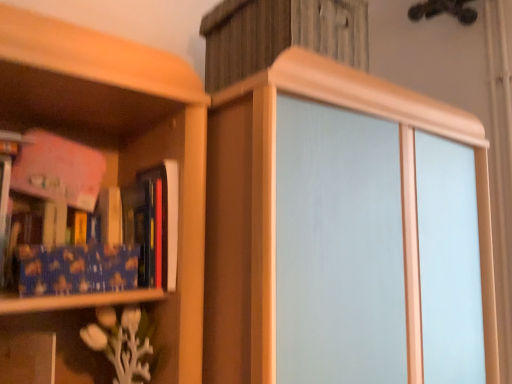
What do you see at coordinates (76, 269) in the screenshot? I see `blue textured paper at left` at bounding box center [76, 269].

Image resolution: width=512 pixels, height=384 pixels. What do you see at coordinates (76, 347) in the screenshot?
I see `white matte vase at lower left` at bounding box center [76, 347].

At what (x,y) coordinates should I click in order to perform the action: click on hardcover book at left, positioned as the second book in left-to-right order. Please return your answer as a coordinate pair (x, y). Looking at the image, I should click on (165, 217).

This screenshot has height=384, width=512. Identify the location of blue textured paper at left. (76, 269).

How much distance is there between blue textured paper at left and hardcover book at left, positioned as the second book in left-to-right order?

blue textured paper at left and hardcover book at left, positioned as the second book in left-to-right order, are 4.78 inches apart.

Is blue textured paper at left aimed at hardcover book at left, positioned as the second book in left-to-right order?

No, blue textured paper at left is not facing towards hardcover book at left, positioned as the second book in left-to-right order.

Looking at this image, which is behind, blue textured paper at left or hardcover book at left, arranged as the first book when viewed from the right?

hardcover book at left, arranged as the first book when viewed from the right.

Considering the sizes of objects blue textured paper at left and hardcover book at left, arranged as the first book when viewed from the right, in the image provided, who is thinner, blue textured paper at left or hardcover book at left, arranged as the first book when viewed from the right,?

blue textured paper at left is thinner.

Does hardcover book at left, positioned as the second book in left-to-right order, turn towards white matte vase at lower left?

No.

Between point (164, 241) and point (90, 342), which one is positioned in front?

The point (164, 241) is in front.

Considering the relative sizes of hardcover book at left, positioned as the second book in left-to-right order, and white matte vase at lower left in the image provided, is hardcover book at left, positioned as the second book in left-to-right order, thinner than white matte vase at lower left?

Yes, hardcover book at left, positioned as the second book in left-to-right order, is thinner than white matte vase at lower left.

Does hardcover book at left, arranged as the first book when viewed from the right, touch white matte vase at lower left?

hardcover book at left, arranged as the first book when viewed from the right, is not next to white matte vase at lower left, and they're not touching.

Is hardcover book at left, arranged as the first book when viewed from the right, placed right next to blue textured fabric book at left, the 2th book viewed from the right?

No.

Can you tell me how much hardcover book at left, arranged as the first book when viewed from the right, and blue textured fabric book at left, the 2th book viewed from the right, differ in facing direction?

7.52 degrees separate the facing orientations of hardcover book at left, arranged as the first book when viewed from the right, and blue textured fabric book at left, the 2th book viewed from the right.

Can you confirm if hardcover book at left, positioned as the second book in left-to-right order, is smaller than blue textured fabric book at left, arranged as the 1th book when viewed from the left?

Yes.

Is the depth of hardcover book at left, arranged as the first book when viewed from the right, greater than that of blue textured fabric book at left, the 2th book viewed from the right?

Yes.

Which is more to the left, white matte vase at lower left or blue textured fabric book at left, the 2th book viewed from the right?

blue textured fabric book at left, the 2th book viewed from the right, is more to the left.

There is a white matte vase at lower left. Identify the location of the 2nd book above it (from the image's perspective). (95, 225).

Consider the image. From a real-world perspective, which is physically above, white matte vase at lower left or blue textured fabric book at left, arranged as the 1th book when viewed from the left?

blue textured fabric book at left, arranged as the 1th book when viewed from the left, is physically above.

Considering the points (99, 375) and (55, 184), which point is behind, point (99, 375) or point (55, 184)?

The point (99, 375) is farther.

Is point (176, 165) closer to viewer compared to point (109, 251)?

Yes, it is in front of point (109, 251).

Between hardcover book at left, arranged as the first book when viewed from the right, and blue textured paper at left, which one has smaller width?

blue textured paper at left is thinner.

Which is more to the left, hardcover book at left, positioned as the second book in left-to-right order, or blue textured paper at left?

From the viewer's perspective, blue textured paper at left appears more on the left side.

Is hardcover book at left, arranged as the first book when viewed from the right, behind blue textured paper at left?

Yes, hardcover book at left, arranged as the first book when viewed from the right, is further from the viewer.

I want to click on shelf below the blue textured fabric book at left, arranged as the 1th book when viewed from the left (from the image's perspective), so click(x=76, y=347).

Which object is further away from the camera taking this photo, blue textured fabric book at left, arranged as the 1th book when viewed from the left, or white matte vase at lower left?

blue textured fabric book at left, arranged as the 1th book when viewed from the left, is behind.

Is blue textured fabric book at left, the 2th book viewed from the right, facing away from white matte vase at lower left?

No, blue textured fabric book at left, the 2th book viewed from the right, is not facing away from white matte vase at lower left.

Considering the relative sizes of blue textured fabric book at left, arranged as the 1th book when viewed from the left, and white matte vase at lower left in the image provided, is blue textured fabric book at left, arranged as the 1th book when viewed from the left, shorter than white matte vase at lower left?

No.

Considering the positions of objects blue textured paper at left and white matte vase at lower left in the image provided, who is more to the right, blue textured paper at left or white matte vase at lower left?

blue textured paper at left is more to the right.

Is point (81, 245) less distant than point (42, 368)?

That is False.

Are blue textured paper at left and white matte vase at lower left making contact?

No, blue textured paper at left is not in contact with white matte vase at lower left.

From a real-world perspective, count 1st books upward from the blue textured paper at left and point to it. Please provide its 2D coordinates.

[(165, 217)]

This screenshot has width=512, height=384. In order to click on shelf in front of the hardcover book at left, positioned as the second book in left-to-right order in this screenshot , I will do `click(76, 347)`.

In the scene shown: When comparing their distances from blue textured paper at left, does white matte vase at lower left or hardcover book at left, positioned as the second book in left-to-right order, seem further?

white matte vase at lower left lies further to blue textured paper at left than the other object.

Estimate the real-world distances between objects in this image. Which object is closer to blue textured paper at left, hardcover book at left, arranged as the first book when viewed from the right, or blue textured fabric book at left, the 2th book viewed from the right?

Based on the image, blue textured fabric book at left, the 2th book viewed from the right, appears to be nearer to blue textured paper at left.

When comparing their distances from blue textured fabric book at left, arranged as the 1th book when viewed from the left, does hardcover book at left, arranged as the first book when viewed from the right, or white matte vase at lower left seem closer?

The object closer to blue textured fabric book at left, arranged as the 1th book when viewed from the left, is hardcover book at left, arranged as the first book when viewed from the right.

Which object lies nearer to the anchor point white matte vase at lower left, blue textured fabric book at left, arranged as the 1th book when viewed from the left, or hardcover book at left, arranged as the first book when viewed from the right?

blue textured fabric book at left, arranged as the 1th book when viewed from the left, is positioned closer to the anchor white matte vase at lower left.

When comparing their distances from blue textured fabric book at left, the 2th book viewed from the right, does white matte vase at lower left or hardcover book at left, arranged as the first book when viewed from the right, seem further?

Among the two, white matte vase at lower left is located further to blue textured fabric book at left, the 2th book viewed from the right.

Considering their positions, is blue textured fabric book at left, arranged as the 1th book when viewed from the left, positioned closer to blue textured paper at left than hardcover book at left, positioned as the second book in left-to-right order?

Based on the image, blue textured fabric book at left, arranged as the 1th book when viewed from the left, appears to be nearer to blue textured paper at left.

From the image, which object appears to be nearer to blue textured paper at left, hardcover book at left, arranged as the first book when viewed from the right, or white matte vase at lower left?

Among the two, hardcover book at left, arranged as the first book when viewed from the right, is located nearer to blue textured paper at left.

When comparing their distances from white matte vase at lower left, does blue textured paper at left or blue textured fabric book at left, the 2th book viewed from the right, seem further?

Based on the image, blue textured fabric book at left, the 2th book viewed from the right, appears to be further to white matte vase at lower left.

I want to click on book between blue textured fabric book at left, the 2th book viewed from the right, and white matte vase at lower left in the up-down direction, so click(x=165, y=217).

You are a GUI agent. You are given a task and a screenshot of the screen. Output one action in this format:
    pyautogui.click(x=<x>, y=<y>)
    Task: Click on the paperback book located between blue textured fabric book at left, arranged as the 1th book when viewed from the left, and hardcover book at left, positioned as the second book in left-to-right order, in the left-right direction
    
    Given the screenshot: What is the action you would take?
    pyautogui.click(x=76, y=269)

The width and height of the screenshot is (512, 384). I want to click on paperback book between hardcover book at left, positioned as the second book in left-to-right order, and white matte vase at lower left, in the vertical direction, so click(x=76, y=269).

This screenshot has width=512, height=384. I want to click on paperback book between blue textured fabric book at left, the 2th book viewed from the right, and white matte vase at lower left from top to bottom, so click(x=76, y=269).